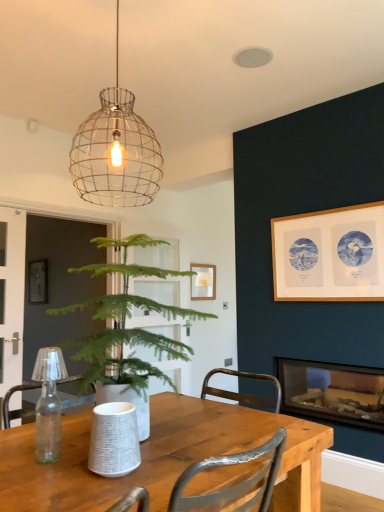
The image size is (384, 512). I want to click on glass fireplace at lower right, so click(x=333, y=392).

This screenshot has height=512, width=384. What do you see at coordinates (116, 152) in the screenshot?
I see `wire mesh pendant light at upper center` at bounding box center [116, 152].

Image resolution: width=384 pixels, height=512 pixels. In order to click on wire mesh pendant light at upper center in this screenshot , I will do `click(116, 152)`.

Where is `glass fireplace at lower right`? The height and width of the screenshot is (512, 384). glass fireplace at lower right is located at coordinates (333, 392).

Considering the sizes of objects wooden table at center and green leafy plant at center in the image provided, who is bigger, wooden table at center or green leafy plant at center?

green leafy plant at center.

In the scene shown: Is wooden table at center not close to green leafy plant at center?

Actually, wooden table at center and green leafy plant at center are a little close together.

I want to click on houseplant on the left side of wooden table at center, so click(127, 330).

Is wooden table at center oriented towards glass fireplace at lower right?

No, wooden table at center does not turn towards glass fireplace at lower right.

From the image's perspective, which is below, wooden table at center or glass fireplace at lower right?

glass fireplace at lower right is shown below in the image.

Can you see wooden table at center touching glass fireplace at lower right?

No, wooden table at center is not touching glass fireplace at lower right.

How much distance is there between wire mesh pendant light at upper center and wooden picture frame at upper right?

A distance of 1.71 meters exists between wire mesh pendant light at upper center and wooden picture frame at upper right.

From the picture: What's the angular difference between wire mesh pendant light at upper center and wooden picture frame at upper right's facing directions?

There is a 177-degree angle between the facing directions of wire mesh pendant light at upper center and wooden picture frame at upper right.

Is wire mesh pendant light at upper center situated inside wooden picture frame at upper right or outside?

wire mesh pendant light at upper center is outside wooden picture frame at upper right.

Considering the sizes of wire mesh pendant light at upper center and wooden picture frame at upper right in the image, is wire mesh pendant light at upper center bigger or smaller than wooden picture frame at upper right?

wire mesh pendant light at upper center is bigger than wooden picture frame at upper right.

The height and width of the screenshot is (512, 384). In order to click on fireplace lying on the right of wooden table at center in this screenshot , I will do `click(333, 392)`.

Would you say glass fireplace at lower right is outside wooden table at center?

Yes, glass fireplace at lower right is located beyond the bounds of wooden table at center.

From the image's perspective, between glass fireplace at lower right and wooden table at center, which one is located above?

wooden table at center.

Between glass fireplace at lower right and wooden table at center, which one is positioned in front?

wooden table at center is closer to the camera.

Is point (333, 255) more distant than point (84, 183)?

Yes, it is.

Is wooden picture frame at upper right at the right side of wire mesh pendant light at upper center?

Correct, you'll find wooden picture frame at upper right to the right of wire mesh pendant light at upper center.

Is wooden picture frame at upper right far away from wire mesh pendant light at upper center?

wooden picture frame at upper right is far away from wire mesh pendant light at upper center.

Is green leafy plant at center in front of or behind wooden table at center in the image?

green leafy plant at center is positioned farther from the viewer than wooden table at center.

Measure the distance between green leafy plant at center and wooden table at center.

green leafy plant at center and wooden table at center are 12.40 inches apart.

Based on the photo, can you confirm if green leafy plant at center is taller than wooden table at center?

Yes.

Are green leafy plant at center and wooden table at center beside each other?

No, green leafy plant at center is not in contact with wooden table at center.

Where is `houseplant lying on the right of wire mesh pendant light at upper center`? houseplant lying on the right of wire mesh pendant light at upper center is located at coordinates (127, 330).

How many degrees apart are the facing directions of wire mesh pendant light at upper center and green leafy plant at center?

There is a 174-degree angle between the facing directions of wire mesh pendant light at upper center and green leafy plant at center.

Is wire mesh pendant light at upper center wider or thinner than green leafy plant at center?

In the image, wire mesh pendant light at upper center appears to be more narrow than green leafy plant at center.

Image resolution: width=384 pixels, height=512 pixels. Find the location of `houseplant above the wooden table at center (from a real-world perspective)`. houseplant above the wooden table at center (from a real-world perspective) is located at coordinates (127, 330).

The height and width of the screenshot is (512, 384). I want to click on fireplace below the wooden table at center (from the image's perspective), so click(x=333, y=392).

Looking at the image, which one is located further to wooden table at center, wire mesh pendant light at upper center or green leafy plant at center?

wire mesh pendant light at upper center is positioned further to the anchor wooden table at center.

Which object lies nearer to the anchor point wooden picture frame at upper right, green leafy plant at center or wire mesh pendant light at upper center?

green leafy plant at center is closer to wooden picture frame at upper right.

Estimate the real-world distances between objects in this image. Which object is further from green leafy plant at center, wooden table at center or wooden picture frame at upper right?

Among the two, wooden picture frame at upper right is located further to green leafy plant at center.

Which object lies further to the anchor point glass fireplace at lower right, wooden table at center or wooden picture frame at upper right?

wooden table at center is further to glass fireplace at lower right.

From the image, which object appears to be nearer to wooden table at center, glass fireplace at lower right or wire mesh pendant light at upper center?

The object closer to wooden table at center is wire mesh pendant light at upper center.

From the image, which object appears to be farther from glass fireplace at lower right, green leafy plant at center or wooden table at center?

green leafy plant at center is further to glass fireplace at lower right.

Estimate the real-world distances between objects in this image. Which object is closer to wire mesh pendant light at upper center, glass fireplace at lower right or wooden table at center?

Among the two, wooden table at center is located nearer to wire mesh pendant light at upper center.

Estimate the real-world distances between objects in this image. Which object is further from wire mesh pendant light at upper center, wooden picture frame at upper right or green leafy plant at center?

The object further to wire mesh pendant light at upper center is wooden picture frame at upper right.

Identify the location of picture frame located between wooden table at center and glass fireplace at lower right in the depth direction. (330, 255).

Locate an element on the screen. houseplant between wire mesh pendant light at upper center and wooden table at center in the up-down direction is located at coordinates (127, 330).

Where is `lamp between wooden table at center and glass fireplace at lower right in the front-back direction`? lamp between wooden table at center and glass fireplace at lower right in the front-back direction is located at coordinates (116, 152).

Identify the location of houseplant between wooden table at center and glass fireplace at lower right from front to back. This screenshot has width=384, height=512. (127, 330).